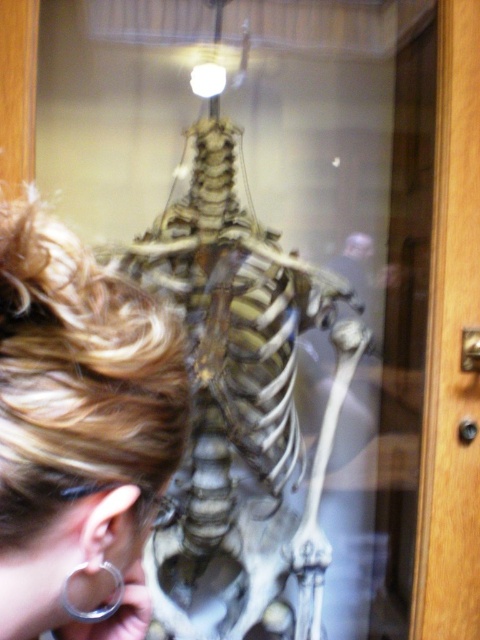
Question: Does bone-like skeleton at center appear under silver metallic ring at lower left?

Choices:
 (A) no
 (B) yes

Answer: (B)

Question: Among these points, which one is nearest to the camera?

Choices:
 (A) (117, 600)
 (B) (274, 292)

Answer: (A)

Question: Which of the following is the closest to the observer?

Choices:
 (A) silver metallic ring at lower left
 (B) bone-like skeleton at center
 (C) blonde hair at upper left

Answer: (C)

Question: Is bone-like skeleton at center above silver metallic ring at lower left?

Choices:
 (A) no
 (B) yes

Answer: (A)

Question: Which point is closer to the camera taking this photo?

Choices:
 (A) (110, 589)
 (B) (141, 428)
 (C) (307, 564)

Answer: (B)

Question: Is blonde hair at upper left below silver metallic ring at lower left?

Choices:
 (A) yes
 (B) no

Answer: (B)